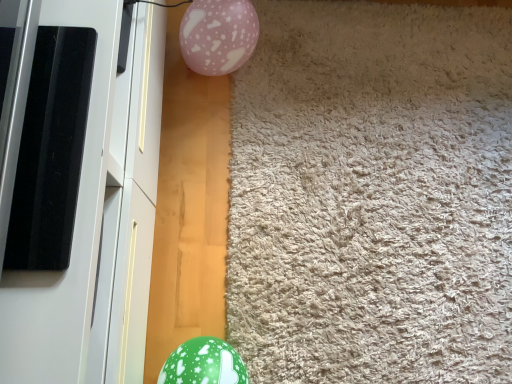
The width and height of the screenshot is (512, 384). Identify the location of empty space that is to the right of pink glossy balloon at upper center. (279, 61).